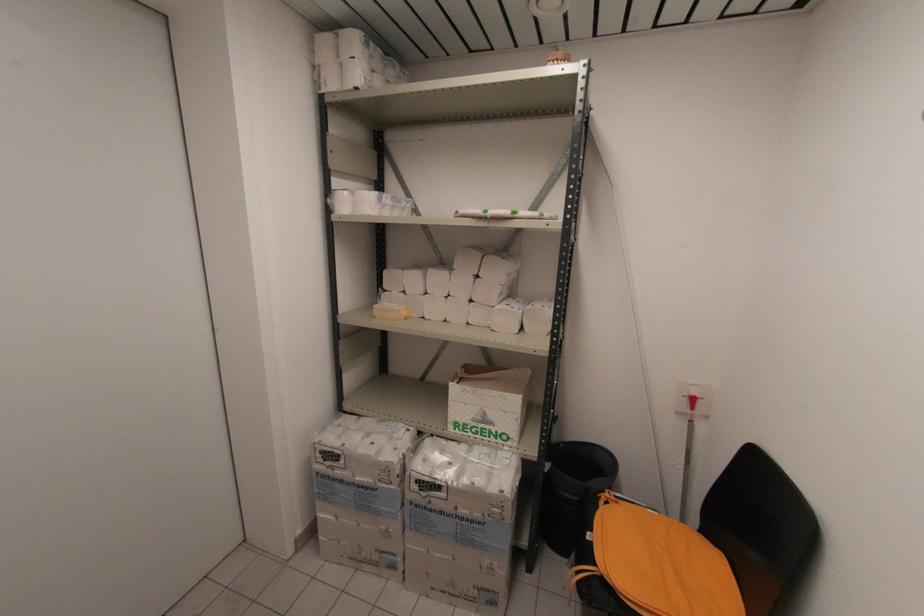
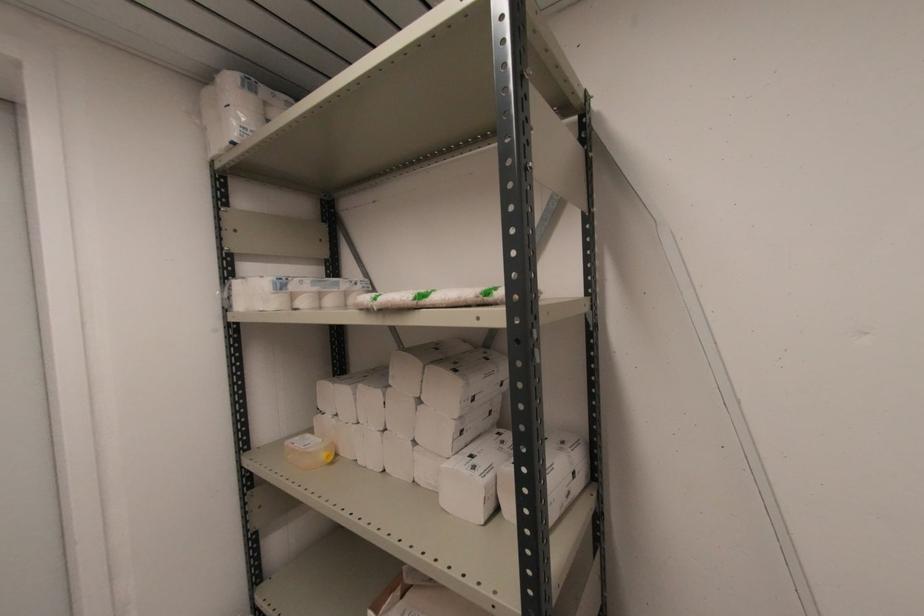
Find the pixel in the second image that matches point (375, 306) in the first image.

(289, 442)